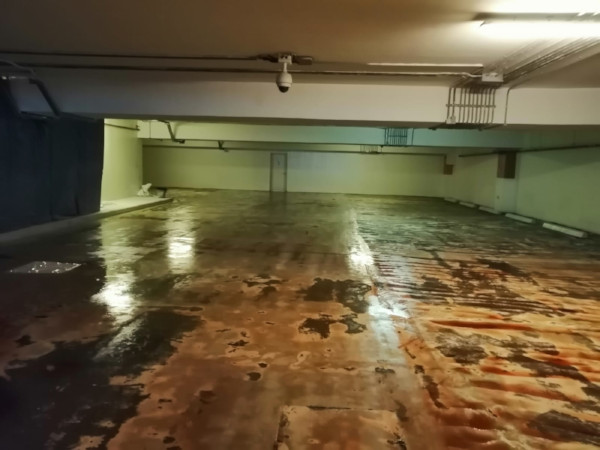
Where is `black ceiling camera`? This screenshot has height=450, width=600. black ceiling camera is located at coordinates (285, 88).